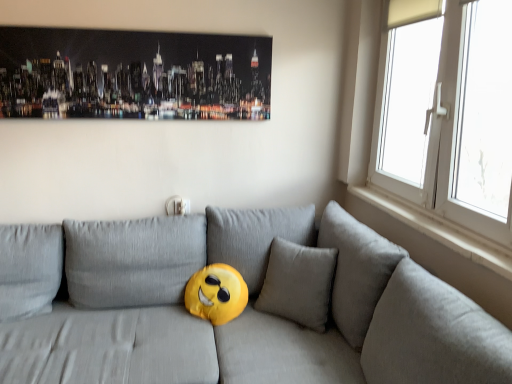
Question: In terms of width, does matte gray couch at center look wider or thinner when compared to metallic cityscape art at upper center?

Choices:
 (A) thin
 (B) wide

Answer: (B)

Question: From the image's perspective, is matte gray couch at center above or below metallic cityscape art at upper center?

Choices:
 (A) above
 (B) below

Answer: (B)

Question: Which object is the closest to the metallic cityscape art at upper center?

Choices:
 (A) white smooth window sill at right
 (B) matte gray couch at center
 (C) white plastic window at right

Answer: (B)

Question: Estimate the real-world distances between objects in this image. Which object is closer to the matte gray couch at center?

Choices:
 (A) metallic cityscape art at upper center
 (B) white smooth window sill at right
 (C) white plastic window at right

Answer: (B)